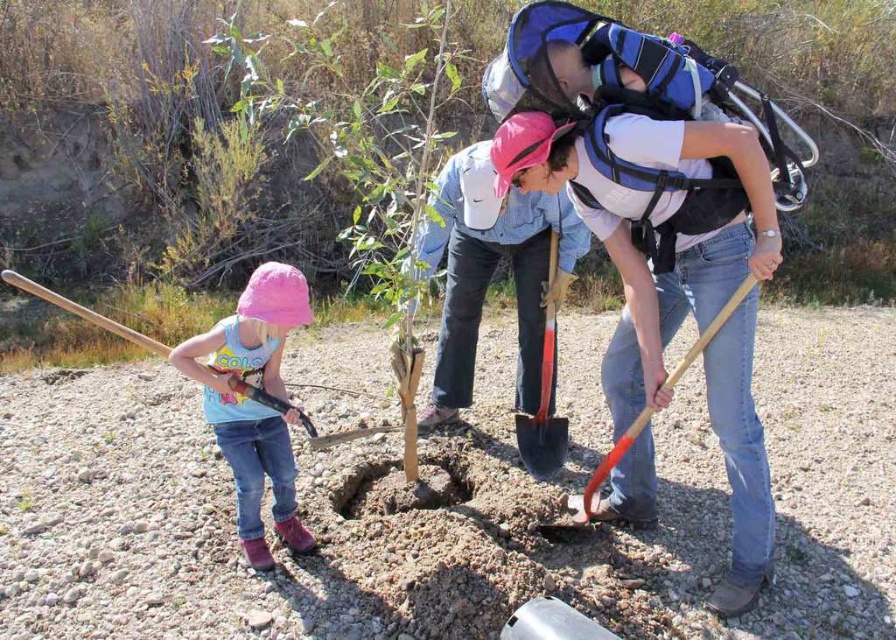
You are a gardener who needs to locate the red plastic shovel at center. Where should you look relative to the pink fabric hat at left?

The pink fabric hat at left is below the red plastic shovel at center, so you should look above the pink fabric hat at left to find the red plastic shovel at center.

You are a gardener who needs to choose between the pink fabric hat at left and the red plastic shovel at center for a quick task. Which item is shorter?

The pink fabric hat at left is shorter than the red plastic shovel at center.

You are a gardener who needs to place a new tree sapling into the brown dirt hole at center. The wooden shovel at left is in your way. Which object should you move first to access the hole?

The wooden shovel at left is behind the brown dirt hole at center, so you should move the wooden shovel at left first to access the hole.